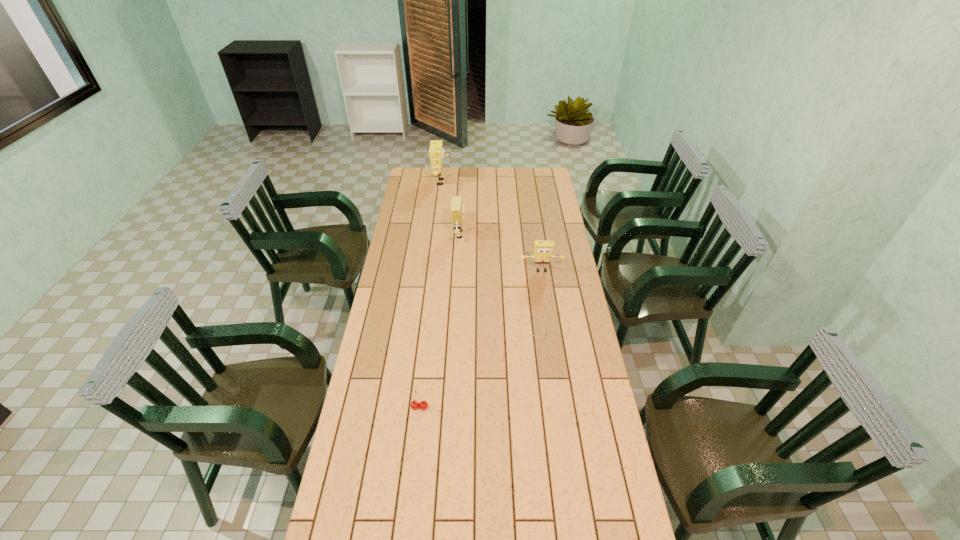
Where is `the farthest sponge`? the farthest sponge is located at coordinates (436, 152).

Where is `the farthest object`? This screenshot has width=960, height=540. the farthest object is located at coordinates (436, 152).

This screenshot has width=960, height=540. I want to click on the second object from right to left, so click(x=457, y=206).

Find the location of a particular element. the third nearest object is located at coordinates (457, 206).

Where is `the rightmost object`? the rightmost object is located at coordinates (543, 250).

Where is `the second shortest object`? the second shortest object is located at coordinates (543, 250).

Where is `the nearest object`? the nearest object is located at coordinates (x=415, y=404).

This screenshot has width=960, height=540. Find the location of `cherry`. cherry is located at coordinates tap(415, 404).

Find the location of a particular element. The width and height of the screenshot is (960, 540). vacant area situated on the front-facing side of the farthest object is located at coordinates (472, 182).

Where is `vacant space situated 0.240m on the face of the second sponge from left to right`? vacant space situated 0.240m on the face of the second sponge from left to right is located at coordinates (516, 234).